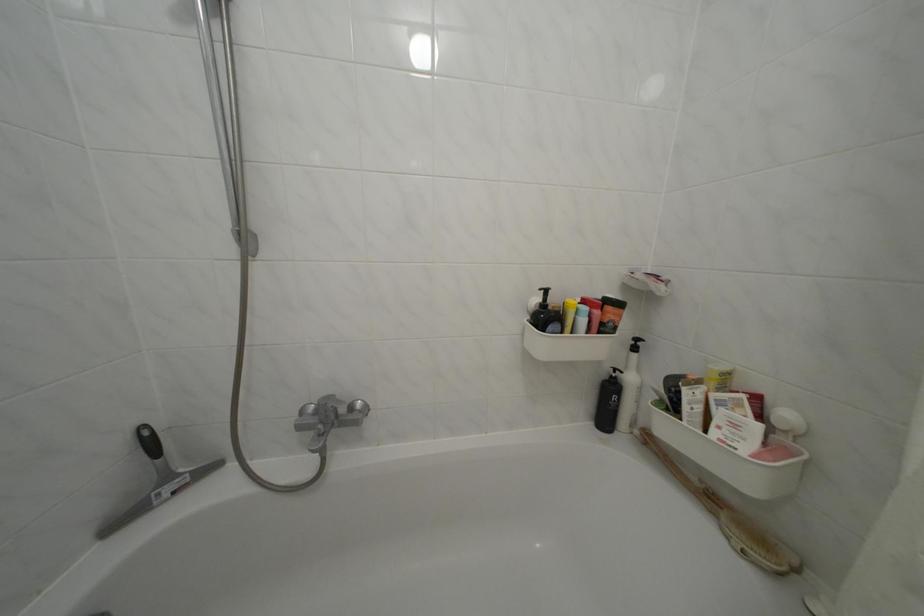
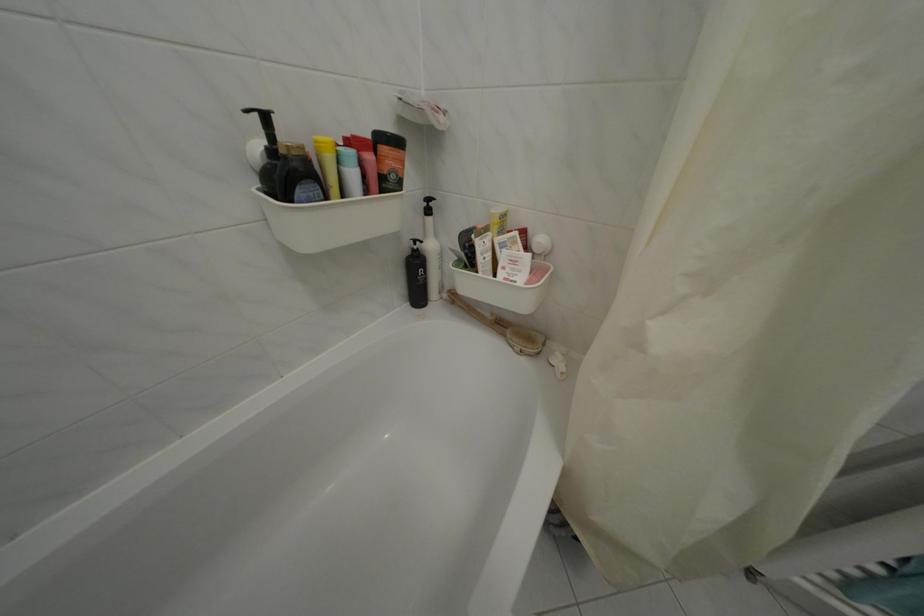
The point at (623, 381) is marked in the first image. Where is the corresponding point in the second image?

(424, 254)